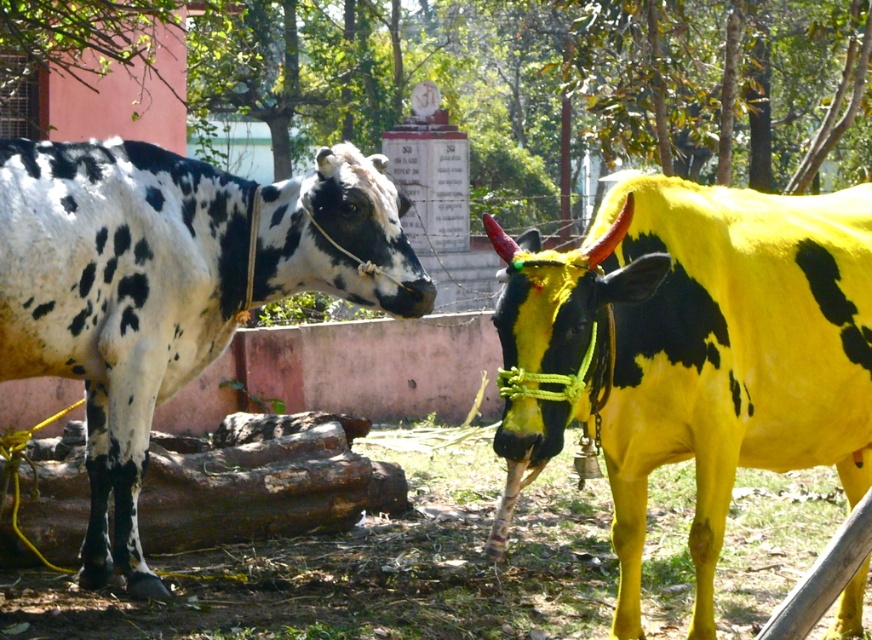
Question: Is yellow painted bull at right to the left of white-spotted cow at left from the viewer's perspective?

Choices:
 (A) no
 (B) yes

Answer: (A)

Question: Which point appears closest to the camera in this image?

Choices:
 (A) (632, 208)
 (B) (155, 580)

Answer: (A)

Question: Does yellow painted bull at right appear on the left side of white-spotted cow at left?

Choices:
 (A) yes
 (B) no

Answer: (B)

Question: Is yellow painted bull at right to the left of white-spotted cow at left from the viewer's perspective?

Choices:
 (A) no
 (B) yes

Answer: (A)